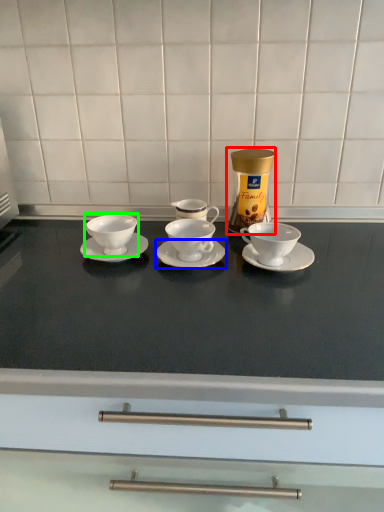
Question: Which object is positioned closest to appliance (highlighted by a red box)? Select from saucer (highlighted by a blue box) and coffee cup (highlighted by a green box).

Choices:
 (A) saucer
 (B) coffee cup

Answer: (A)